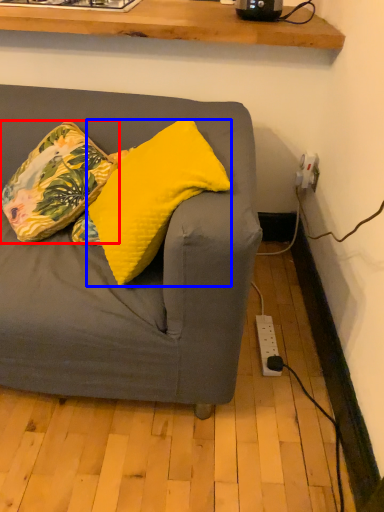
Question: Which object appears closest to the camera in this image, pillow (highlighted by a red box) or pillow (highlighted by a blue box)?

Choices:
 (A) pillow
 (B) pillow

Answer: (B)